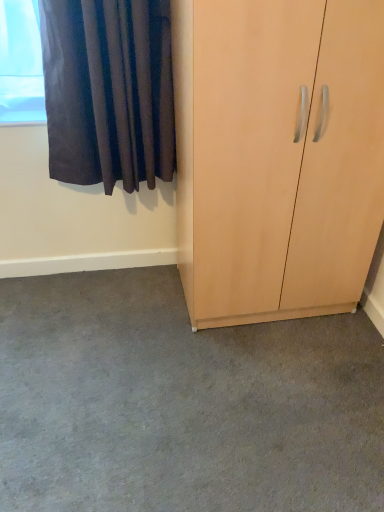
Question: Should I look upward or downward to see light wood cupboard at right?

Choices:
 (A) down
 (B) up

Answer: (B)

Question: Does light wood cupboard at right lie behind gray carpet at lower center?

Choices:
 (A) no
 (B) yes

Answer: (A)

Question: From the image's perspective, is light wood cupboard at right on top of gray carpet at lower center?

Choices:
 (A) yes
 (B) no

Answer: (A)

Question: From the image's perspective, is light wood cupboard at right beneath gray carpet at lower center?

Choices:
 (A) yes
 (B) no

Answer: (B)

Question: From a real-world perspective, does light wood cupboard at right sit lower than gray carpet at lower center?

Choices:
 (A) no
 (B) yes

Answer: (A)

Question: Does light wood cupboard at right touch gray carpet at lower center?

Choices:
 (A) no
 (B) yes

Answer: (A)

Question: Is light wood cupboard at right oriented away from gray carpet at lower center?

Choices:
 (A) no
 (B) yes

Answer: (A)

Question: Would you say gray carpet at lower center contains light wood cupboard at right?

Choices:
 (A) no
 (B) yes

Answer: (A)

Question: Is gray carpet at lower center turned away from light wood cupboard at right?

Choices:
 (A) no
 (B) yes

Answer: (A)

Question: Is gray carpet at lower center thinner than light wood cupboard at right?

Choices:
 (A) yes
 (B) no

Answer: (B)

Question: Is the position of gray carpet at lower center more distant than that of light wood cupboard at right?

Choices:
 (A) no
 (B) yes

Answer: (B)

Question: From the image's perspective, would you say gray carpet at lower center is shown under light wood cupboard at right?

Choices:
 (A) no
 (B) yes

Answer: (B)

Question: From a real-world perspective, is gray carpet at lower center under light wood cupboard at right?

Choices:
 (A) yes
 (B) no

Answer: (A)

Question: From a real-world perspective, is dark velvet curtain at upper left beneath gray carpet at lower center?

Choices:
 (A) yes
 (B) no

Answer: (B)